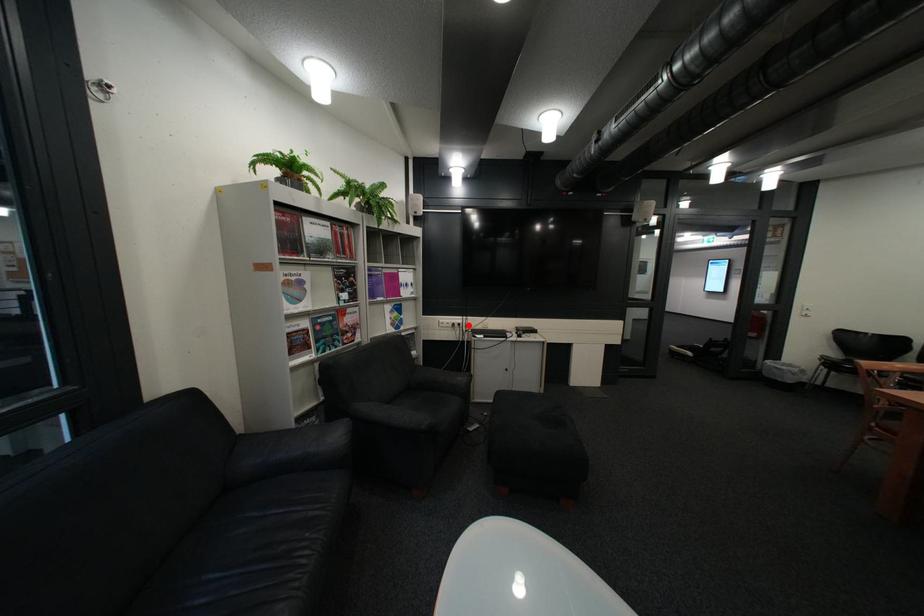
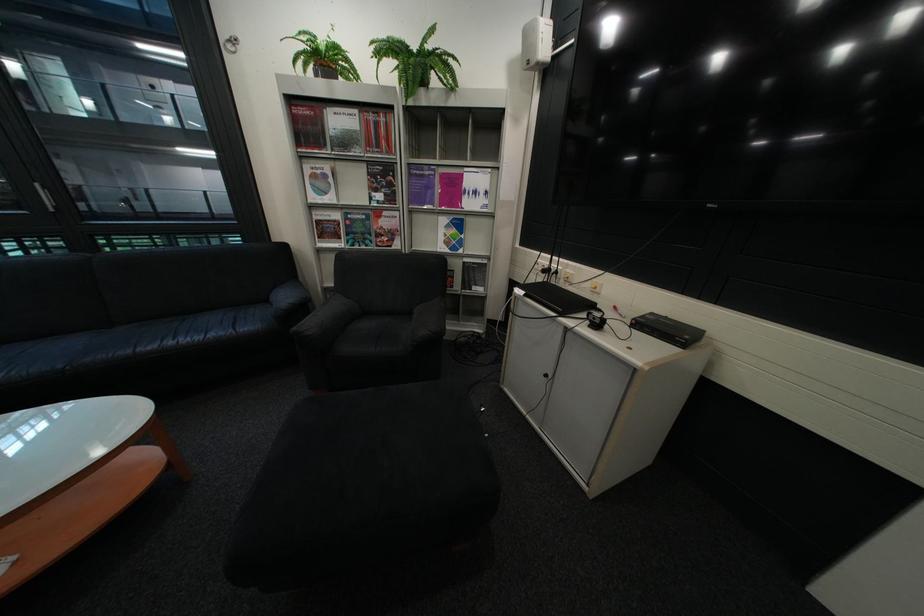
The point at the highlighted location is marked in the first image. Where is the corresponding point in the second image?

(563, 270)